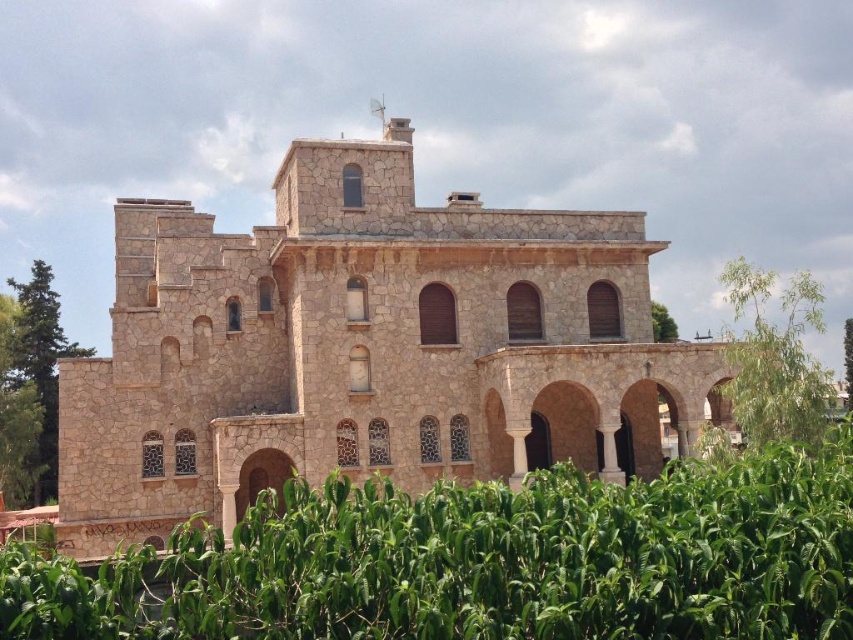
Question: Is green leafy corn field at lower center to the right of green leafy tree at right from the viewer's perspective?

Choices:
 (A) yes
 (B) no

Answer: (B)

Question: Can you confirm if beige stone church at center is bigger than green leafy tree at right?

Choices:
 (A) yes
 (B) no

Answer: (B)

Question: Which object appears closest to the camera in this image?

Choices:
 (A) beige stone church at center
 (B) green leafy corn field at lower center

Answer: (B)

Question: Which of the following is the closest to the observer?

Choices:
 (A) beige stone church at center
 (B) green leafy tree at right
 (C) green leafy corn field at lower center

Answer: (C)

Question: Is beige stone church at center wider than green leafy tree at left?

Choices:
 (A) no
 (B) yes

Answer: (B)

Question: Among these points, which one is nearest to the camera?

Choices:
 (A) (368, 205)
 (B) (775, 364)
 (C) (44, 323)

Answer: (B)